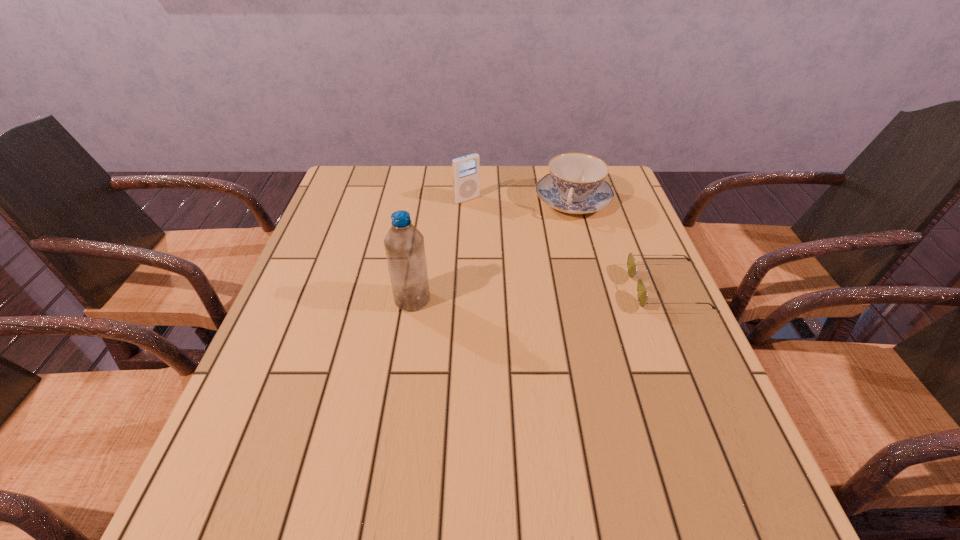
You are a GUI agent. You are given a task and a screenshot of the screen. Output one action in this format:
    pyautogui.click(x=<x>, y=<y>)
    Task: Click on the leftmost object
    This screenshot has height=540, width=960.
    Given the screenshot: What is the action you would take?
    pyautogui.click(x=404, y=244)

Where is `the tallest object`? the tallest object is located at coordinates (404, 244).

Where is `the shortest object`? Image resolution: width=960 pixels, height=540 pixels. the shortest object is located at coordinates (642, 295).

Image resolution: width=960 pixels, height=540 pixels. I want to click on the third tallest object, so click(575, 185).

You are a GUI agent. You are given a task and a screenshot of the screen. Output one action in this format:
    pyautogui.click(x=<x>, y=<y>)
    Task: Click on the iPod
    Image resolution: width=960 pixels, height=540 pixels.
    Given the screenshot: What is the action you would take?
    pyautogui.click(x=466, y=170)

Image resolution: width=960 pixels, height=540 pixels. In order to click on the second object from left to right in this screenshot , I will do `click(466, 170)`.

At what (x,y) coordinates should I click in order to perform the action: click on free space located 0.300m on the right of the water bottle. Please return your answer as a coordinate pair (x, y). The height and width of the screenshot is (540, 960). Looking at the image, I should click on (558, 300).

I want to click on blank space located 0.220m on the front-facing side of the sunglasses, so click(x=542, y=288).

Image resolution: width=960 pixels, height=540 pixels. What are the coordinates of `free location located on the front-facing side of the sunglasses` in the screenshot? It's located at (550, 288).

The height and width of the screenshot is (540, 960). Identify the location of vacant space located on the front-facing side of the sunglasses. (546, 288).